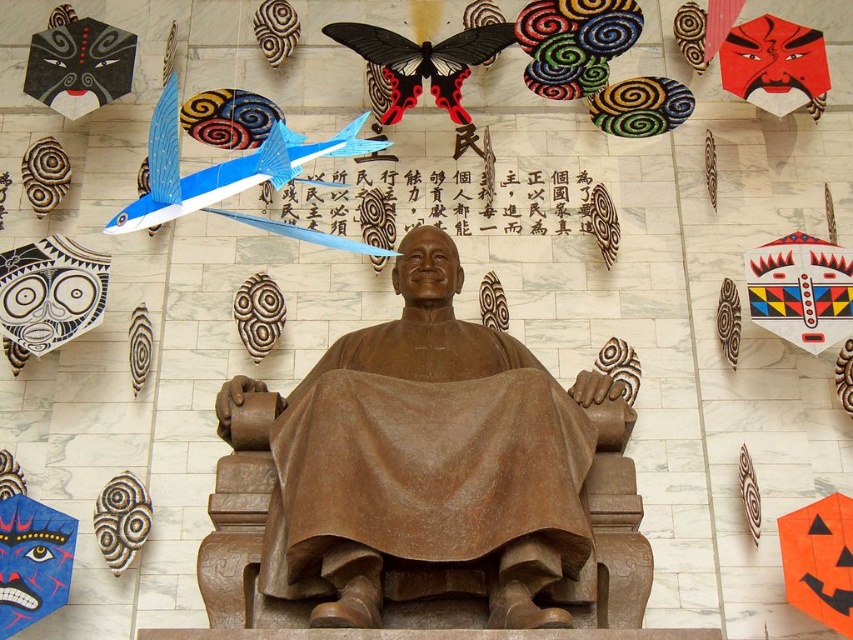
Question: Is bronze statue at center closer to the viewer compared to spiral-patterned wood at lower left?

Choices:
 (A) no
 (B) yes

Answer: (B)

Question: Where is bronze statue at center located in relation to red matte mask at upper right in the image?

Choices:
 (A) left
 (B) right

Answer: (A)

Question: Among these points, which one is nearest to the camera?

Choices:
 (A) (131, 545)
 (B) (363, 481)
 (C) (817, 74)

Answer: (B)

Question: Which of these objects is positioned closest to the bronze statue at center?

Choices:
 (A) red matte mask at upper right
 (B) spiral-patterned wood at lower left

Answer: (B)

Question: Among these points, which one is farthest from the camera?

Choices:
 (A) (757, 92)
 (B) (120, 472)

Answer: (A)

Question: Does bronze statue at center come in front of red matte mask at upper right?

Choices:
 (A) yes
 (B) no

Answer: (A)